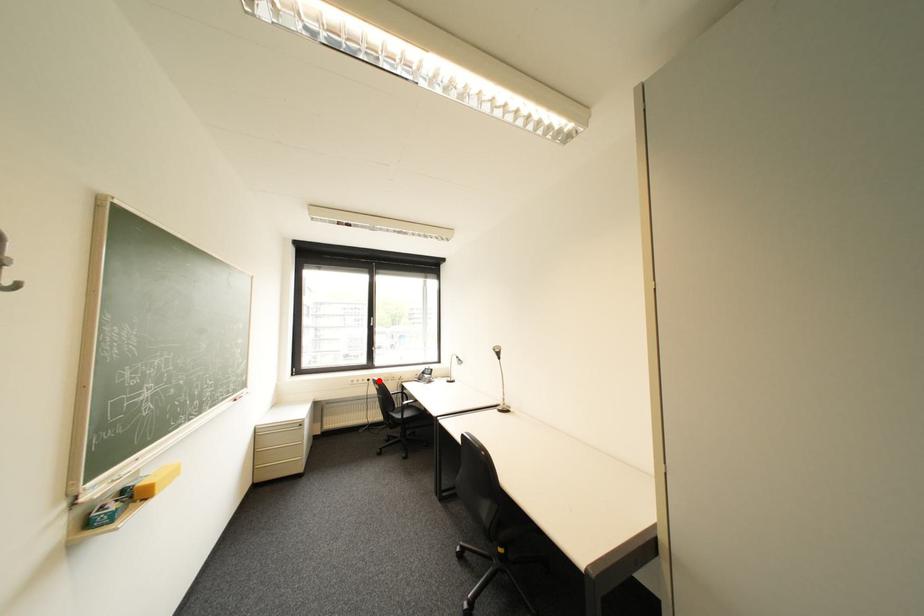
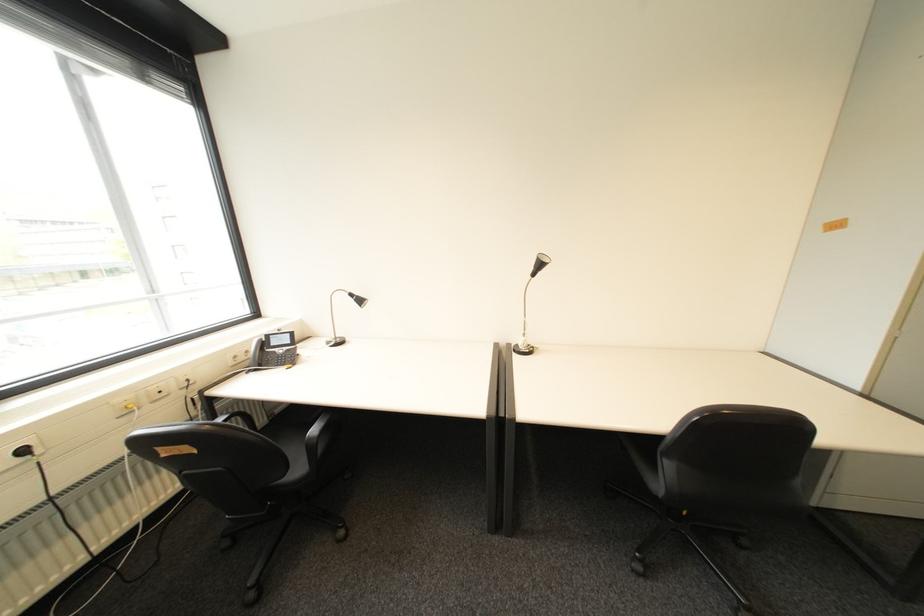
In the second image, find the point that corresponds to the highlighted location in the first image.

(34, 452)